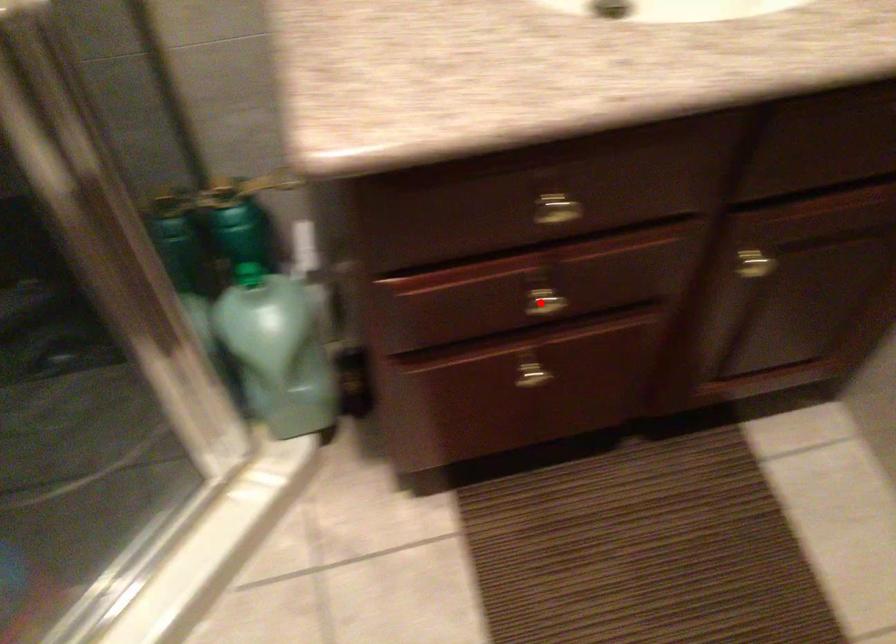
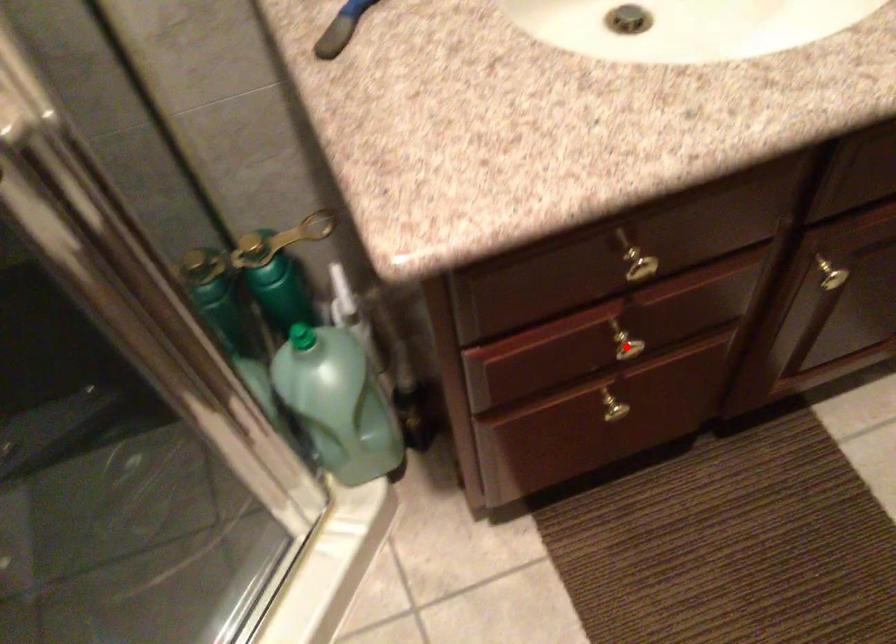
I am providing you with two images of the same scene from different viewpoints. A red point is marked on the first image and another point is marked on the second image. Is the red point in image1 aligned with the point shown in image2?

Yes